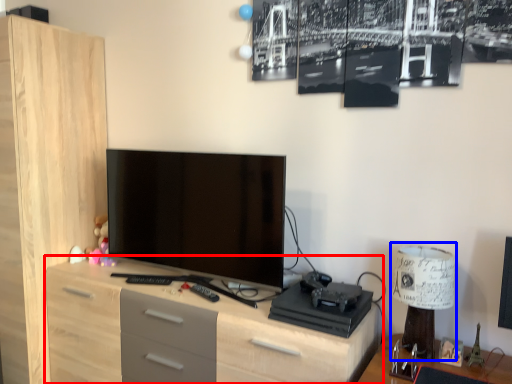
Question: Among these objects, which one is farthest to the camera, chest of drawers (highlighted by a red box) or table lamp (highlighted by a blue box)?

Choices:
 (A) chest of drawers
 (B) table lamp

Answer: (B)